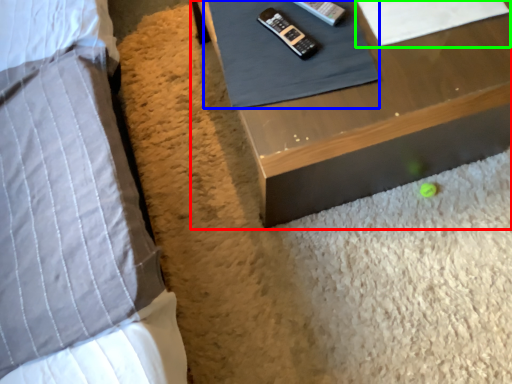
Question: Which object is the farthest from table (highlighted by a red box)? Choose among these: sheet (highlighted by a blue box) or sheet (highlighted by a green box).

Choices:
 (A) sheet
 (B) sheet

Answer: (B)